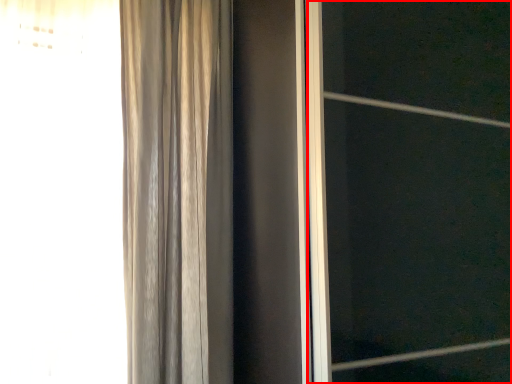
Question: From the image's perspective, where is screen door (annotated by the red box) located in relation to curtain in the image?

Choices:
 (A) below
 (B) above

Answer: (A)